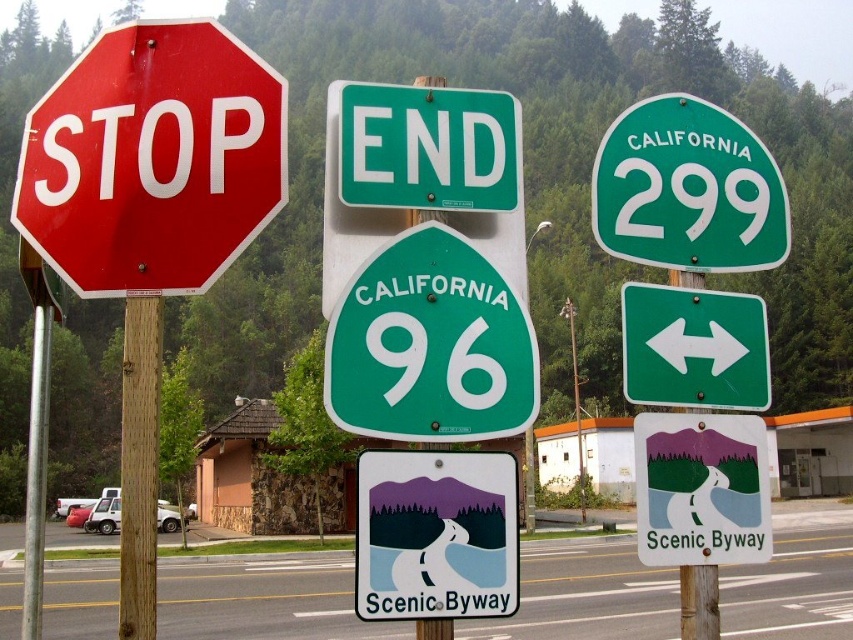
You are a delivery driver approaching this scenic route with two signs in front of you. The white plastic sign at center and the green painted wood sign at center are both mounted on poles. Which of these two signs is narrower in width?

The white plastic sign at center is thinner than the green painted wood sign at center, so the white plastic sign at center is narrower in width.

You are a hiker who just finished a long trek and sees the white plastic sign at center and the green painted wood sign at center. Which one is positioned more to the left?

The white plastic sign at center is positioned more to the left than the green painted wood sign at center.